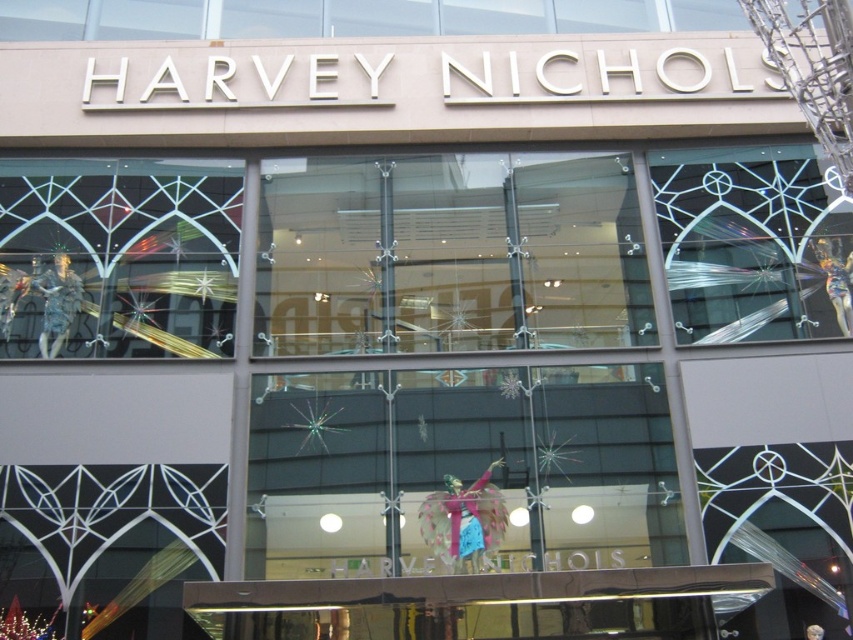
Question: Which point is closer to the camera?

Choices:
 (A) (105, 253)
 (B) (699, 227)

Answer: (A)

Question: Is transparent glass angel at center further to the viewer compared to clear glass window at upper right?

Choices:
 (A) no
 (B) yes

Answer: (A)

Question: Considering the real-world distances, which object is closest to the transparent glass angel at center?

Choices:
 (A) clear glass window at upper right
 (B) metallic silver mannequin at left

Answer: (A)

Question: Which point appears farthest from the camera in this image?

Choices:
 (A) (281, 532)
 (B) (112, 307)

Answer: (B)

Question: Observing the image, what is the correct spatial positioning of transparent glass angel at center in reference to metallic silver mannequin at left?

Choices:
 (A) below
 (B) above

Answer: (A)

Question: Is metallic silver mannequin at left to the right of clear glass window at upper right from the viewer's perspective?

Choices:
 (A) yes
 (B) no

Answer: (B)